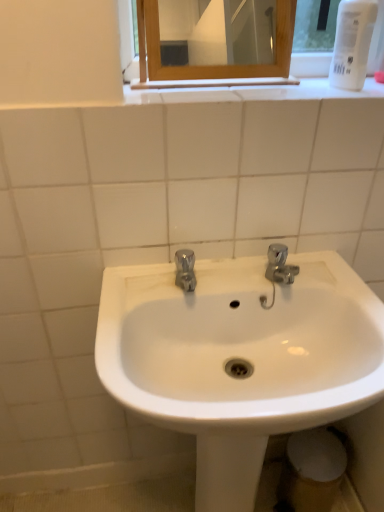
You are a GUI agent. You are given a task and a screenshot of the screen. Output one action in this format:
    pyautogui.click(x=<x>, y=<y>)
    Task: Click on the wooden-framed mirror at upper center
    
    Given the screenshot: What is the action you would take?
    pyautogui.click(x=217, y=32)

What is the approximate width of white glossy sink at center?

It is 16.84 inches.

Measure the distance between polished chrome faucet at center and camera.

A distance of 35.50 inches exists between polished chrome faucet at center and camera.

Identify the location of wooden-framed mirror at upper center. The height and width of the screenshot is (512, 384). (217, 32).

Is white glossy sink at center directly adjacent to polished chrome faucet at center?

No, white glossy sink at center is not next to polished chrome faucet at center.

Which of these two, white glossy sink at center or polished chrome faucet at center, stands taller?

With more height is white glossy sink at center.

Could you tell me if white glossy sink at center is turned towards polished chrome faucet at center?

No, white glossy sink at center is not oriented towards polished chrome faucet at center.

Looking at the image, does white glossy sink at center seem bigger or smaller compared to polished chrome faucet at center?

Clearly, white glossy sink at center is larger in size than polished chrome faucet at center.

Is polished chrome faucet at center not inside white plastic bottle at upper right?

Yes, polished chrome faucet at center is located beyond the bounds of white plastic bottle at upper right.

In the scene shown: Which is more to the left, polished chrome faucet at center or white plastic bottle at upper right?

polished chrome faucet at center.

Where is `tap behind the white plastic bottle at upper right`? This screenshot has height=512, width=384. tap behind the white plastic bottle at upper right is located at coordinates (185, 269).

Looking at their sizes, would you say polished chrome faucet at center is wider or thinner than white plastic bottle at upper right?

In the image, polished chrome faucet at center appears to be more narrow than white plastic bottle at upper right.

Is white plastic bottle at upper right thinner than wooden-framed mirror at upper center?

In fact, white plastic bottle at upper right might be wider than wooden-framed mirror at upper center.

Is white plastic bottle at upper right taller or shorter than wooden-framed mirror at upper center?

In the image, white plastic bottle at upper right appears to be taller than wooden-framed mirror at upper center.

Which is more to the left, white plastic bottle at upper right or wooden-framed mirror at upper center?

wooden-framed mirror at upper center is more to the left.

Are white plastic bottle at upper right and wooden-framed mirror at upper center far apart?

That's right, there is a large distance between white plastic bottle at upper right and wooden-framed mirror at upper center.

Can you confirm if polished chrome faucet at center is wider than wooden-framed mirror at upper center?

No, polished chrome faucet at center is not wider than wooden-framed mirror at upper center.

Which object is positioned more to the right, polished chrome faucet at center or wooden-framed mirror at upper center?

wooden-framed mirror at upper center.

Does polished chrome faucet at center have a greater height compared to wooden-framed mirror at upper center?

Incorrect, the height of polished chrome faucet at center is not larger of that of wooden-framed mirror at upper center.

Is polished chrome faucet at center smaller than wooden-framed mirror at upper center?

Correct, polished chrome faucet at center occupies less space than wooden-framed mirror at upper center.

Is polished chrome faucet at center taller than white glossy sink at center?

In fact, polished chrome faucet at center may be shorter than white glossy sink at center.

Can you confirm if polished chrome faucet at center is wider than white glossy sink at center?

Incorrect, the width of polished chrome faucet at center does not surpass that of white glossy sink at center.

From a real-world perspective, is polished chrome faucet at center positioned above or below white glossy sink at center?

polished chrome faucet at center is above white glossy sink at center.

Looking at this image, is white glossy sink at center at the back of polished chrome faucet at center?

No, white glossy sink at center is not at the back of polished chrome faucet at center.

From the picture: From the image's perspective, is wooden-framed mirror at upper center above or below white plastic bottle at upper right?

wooden-framed mirror at upper center is below white plastic bottle at upper right.

Considering the positions of objects wooden-framed mirror at upper center and white plastic bottle at upper right in the image provided, who is behind, wooden-framed mirror at upper center or white plastic bottle at upper right?

wooden-framed mirror at upper center is behind.

Are wooden-framed mirror at upper center and white plastic bottle at upper right beside each other?

No, wooden-framed mirror at upper center is not in contact with white plastic bottle at upper right.

From a real-world perspective, is wooden-framed mirror at upper center above or below white plastic bottle at upper right?

Clearly, from a real-world perspective, wooden-framed mirror at upper center is below white plastic bottle at upper right.

Visually, is wooden-framed mirror at upper center positioned to the left or to the right of white glossy sink at center?

In the image, wooden-framed mirror at upper center appears on the left side of white glossy sink at center.

Which object is thinner, wooden-framed mirror at upper center or white glossy sink at center?

wooden-framed mirror at upper center.

Is wooden-framed mirror at upper center oriented towards white glossy sink at center?

No, wooden-framed mirror at upper center is not facing towards white glossy sink at center.

Identify the location of sink below the wooden-framed mirror at upper center (from a real-world perspective). (240, 358).

At what (x,y) coordinates should I click in order to perform the action: click on tap above the white glossy sink at center (from the image's perspective). Please return your answer as a coordinate pair (x, y). Image resolution: width=384 pixels, height=512 pixels. Looking at the image, I should click on (185, 269).

The width and height of the screenshot is (384, 512). Identify the location of mouthwash lying on the right of polished chrome faucet at center. (352, 42).

Looking at the image, which one is located further to white glossy sink at center, wooden-framed mirror at upper center or white plastic bottle at upper right?

wooden-framed mirror at upper center is positioned further to the anchor white glossy sink at center.

Considering their positions, is white glossy sink at center positioned closer to white plastic bottle at upper right than polished chrome faucet at center?

Based on the image, polished chrome faucet at center appears to be nearer to white plastic bottle at upper right.

From the image, which object appears to be farther from polished chrome faucet at center, white plastic bottle at upper right or wooden-framed mirror at upper center?

wooden-framed mirror at upper center lies further to polished chrome faucet at center than the other object.

In the scene shown: Which object lies nearer to the anchor point wooden-framed mirror at upper center, polished chrome faucet at center or white glossy sink at center?

Based on the image, white glossy sink at center appears to be nearer to wooden-framed mirror at upper center.

In the scene shown: From the image, which object appears to be nearer to white plastic bottle at upper right, polished chrome faucet at center or white glossy sink at center?

polished chrome faucet at center is closer to white plastic bottle at upper right.

Based on their spatial positions, is white plastic bottle at upper right or white glossy sink at center closer to polished chrome faucet at center?

white glossy sink at center.

Estimate the real-world distances between objects in this image. Which object is closer to white glossy sink at center, polished chrome faucet at center or white plastic bottle at upper right?

polished chrome faucet at center is closer to white glossy sink at center.

Based on their spatial positions, is white plastic bottle at upper right or polished chrome faucet at center closer to wooden-framed mirror at upper center?

white plastic bottle at upper right.

You are a GUI agent. You are given a task and a screenshot of the screen. Output one action in this format:
    pyautogui.click(x=<x>, y=<y>)
    Task: Click on the tap between wooden-framed mirror at upper center and white glossy sink at center from top to bottom
    The image size is (384, 512).
    Given the screenshot: What is the action you would take?
    pyautogui.click(x=185, y=269)

The height and width of the screenshot is (512, 384). Find the location of `tap between white plastic bottle at upper right and white glossy sink at center in the up-down direction`. tap between white plastic bottle at upper right and white glossy sink at center in the up-down direction is located at coordinates (185, 269).

Find the location of a particular element. This screenshot has width=384, height=512. mirror between white plastic bottle at upper right and polished chrome faucet at center vertically is located at coordinates (217, 32).

Find the location of a particular element. This screenshot has height=512, width=384. mirror between white plastic bottle at upper right and white glossy sink at center from top to bottom is located at coordinates (217, 32).